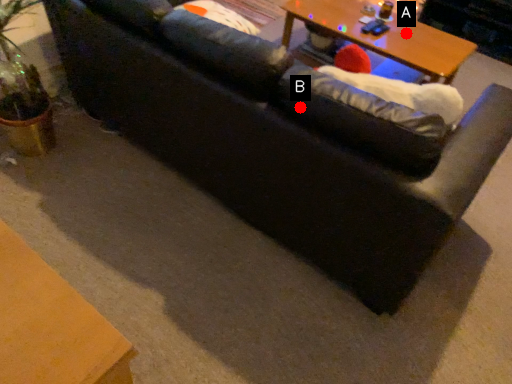
Question: Two points are circled on the image, labeled by A and B beside each circle. Which of the following is the farthest from the observer?

Choices:
 (A) A is further
 (B) B is further

Answer: (A)